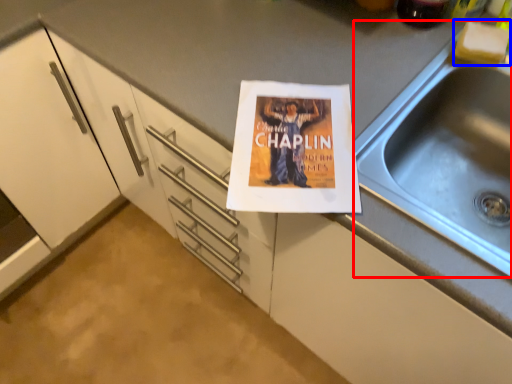
Question: Among these objects, which one is farthest to the camera, sink (highlighted by a red box) or food (highlighted by a blue box)?

Choices:
 (A) sink
 (B) food

Answer: (B)